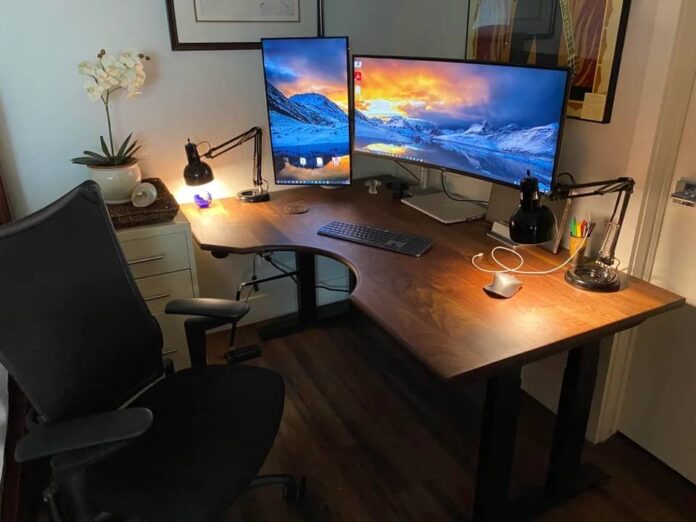
I want to click on screen, so click(x=322, y=106), click(x=459, y=106).